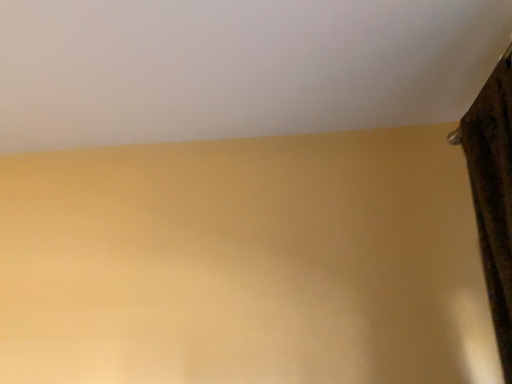
Find the location of `brown textured curtain at right`. brown textured curtain at right is located at coordinates (493, 194).

The image size is (512, 384). What do you see at coordinates (493, 194) in the screenshot? I see `brown textured curtain at right` at bounding box center [493, 194].

You are a GUI agent. You are given a task and a screenshot of the screen. Output one action in this format:
    pyautogui.click(x=<x>, y=<y>)
    Task: Click on the brown textured curtain at right
    
    Given the screenshot: What is the action you would take?
    pyautogui.click(x=493, y=194)